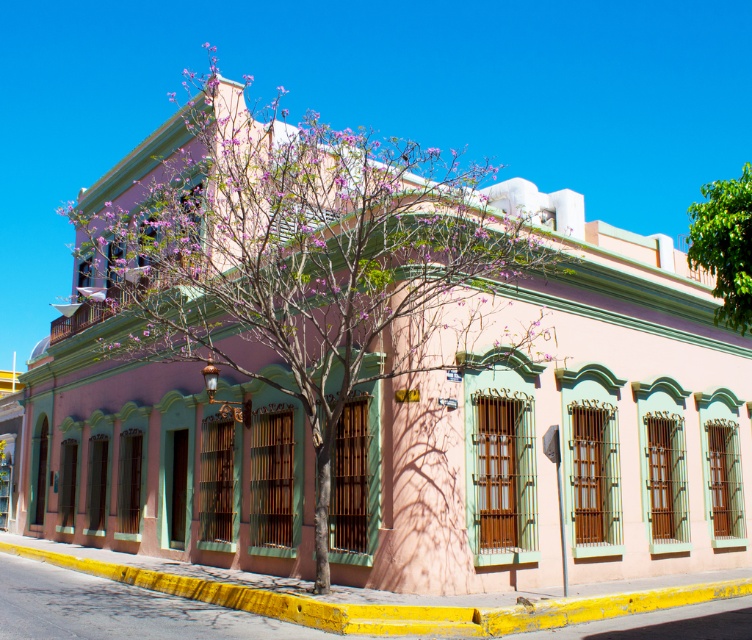
You are a landscape architect planning to plant a new tree between the pink textured tree at center and the green leafy tree at upper right. What is the minimum spacing required between the two existing trees to ensure the new tree has enough space?

The minimum spacing required between the pink textured tree at center and the green leafy tree at upper right is 67.51 feet, so the new tree should be placed at least 67.51 feet away from both existing trees to ensure adequate space.

You are standing in front of the two story building. You see two points marked on the building. One is at point (393, 180) and the other is at point (714, 211). Which point is closer to you?

Point (393, 180) is further to the camera than point (714, 211). Therefore, point (714, 211) is closer to you.

You are a gardener assessing the trees in front of the building. Which tree, the pink textured tree at center or the green leafy tree at upper right, has a smaller trunk diameter?

The pink textured tree at center has a smaller trunk diameter than the green leafy tree at upper right.